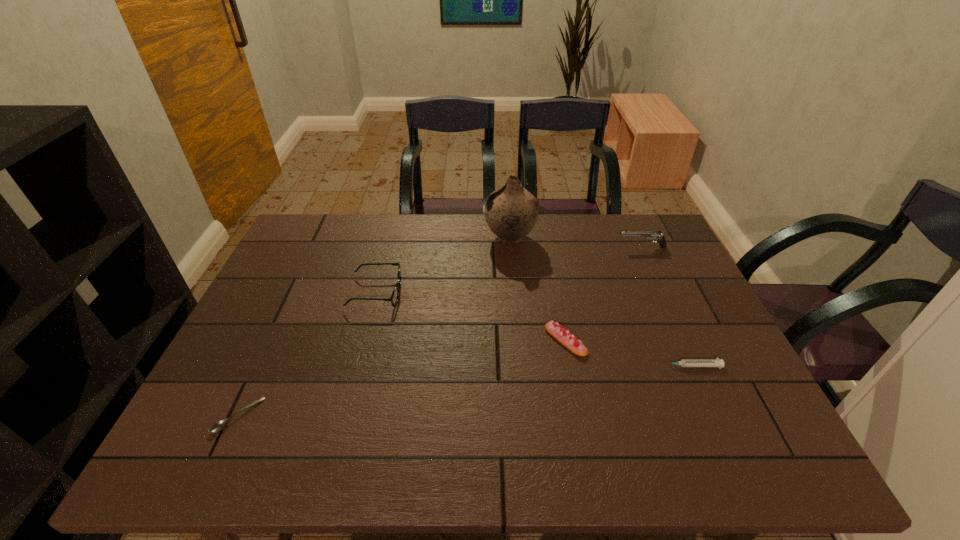
This screenshot has width=960, height=540. In order to click on empty location between the spectacles and the nearest object in this screenshot , I will do `click(307, 354)`.

You are a GUI agent. You are given a task and a screenshot of the screen. Output one action in this format:
    pyautogui.click(x=<x>, y=<y>)
    Task: Click on the empty location between the fourth tallest object and the nearest object
    This screenshot has height=540, width=960.
    Given the screenshot: What is the action you would take?
    pyautogui.click(x=402, y=378)

You are a GUI agent. You are given a task and a screenshot of the screen. Output one action in this format:
    pyautogui.click(x=<x>, y=<y>)
    Task: Click on the vacant point located between the tallest object and the fourth farthest object
    This screenshot has height=540, width=960.
    Given the screenshot: What is the action you would take?
    pyautogui.click(x=538, y=289)

Find the location of `vacant space that's between the fifth farthest object and the pottery`. vacant space that's between the fifth farthest object and the pottery is located at coordinates (600, 302).

The height and width of the screenshot is (540, 960). What are the coordinates of `free space between the fifth tallest object and the pistol` in the screenshot? It's located at (666, 307).

Where is `vacant space in between the syringe and the second object from left to right`? vacant space in between the syringe and the second object from left to right is located at coordinates (533, 329).

In order to click on unoccupied area between the third tallest object and the pottery in this screenshot , I will do `click(443, 265)`.

Where is `object that stands as the fifth closest to the pottery`? This screenshot has height=540, width=960. object that stands as the fifth closest to the pottery is located at coordinates (220, 425).

Identify which object is the nearest to the nearest object. Please provide its 2D coordinates. Your answer should be formatted as a tuple, i.e. [(x, y)], where the tuple contains the x and y coordinates of a point satisfying the conditions above.

[(395, 295)]

The width and height of the screenshot is (960, 540). What are the coordinates of `vacant space that satisfies the following two spatial constraints: 1. from the spout of the pottery; 2. on the front side of the nearest object` in the screenshot? It's located at (526, 416).